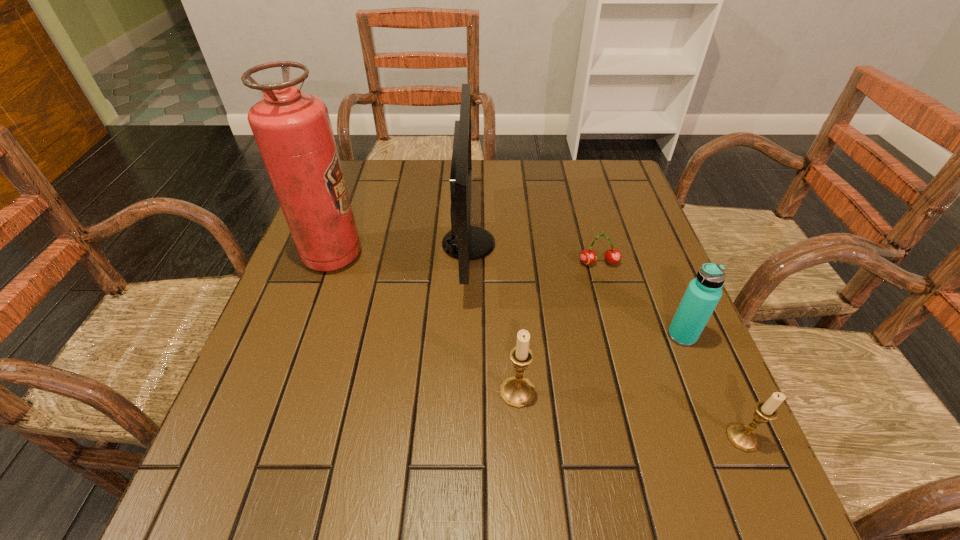
Observe the arrangement of all candle holders in the image. To keep them evenly spaced, where would you place another candle holder on the left? Please locate a free space. Please provide its 2D coordinates. Your answer should be formatted as a tuple, i.e. [(x, y)], where the tuple contains the x and y coordinates of a point satisfying the conditions above.

[(324, 353)]